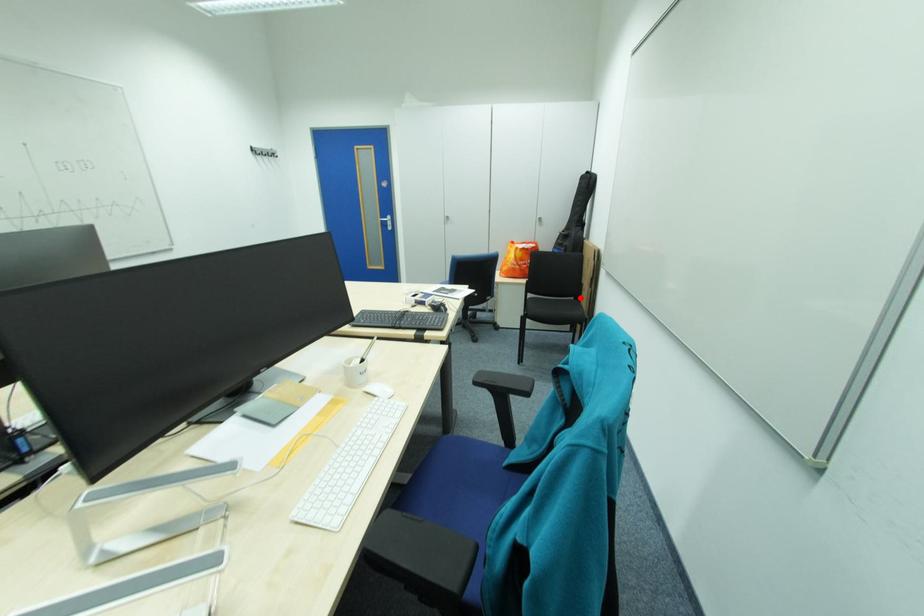
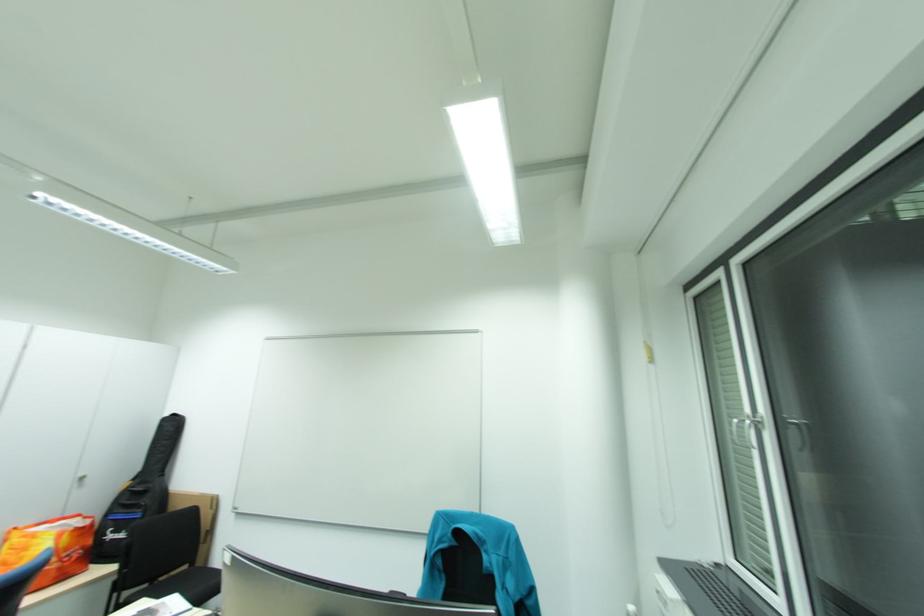
Question: A red point is marked in image1. In image2, is the corresponding 3D point closer to the camera or farther? Reply with the corresponding letter.

Choices:
 (A) The corresponding 3D point is closer.
 (B) The corresponding 3D point is farther.

Answer: (B)